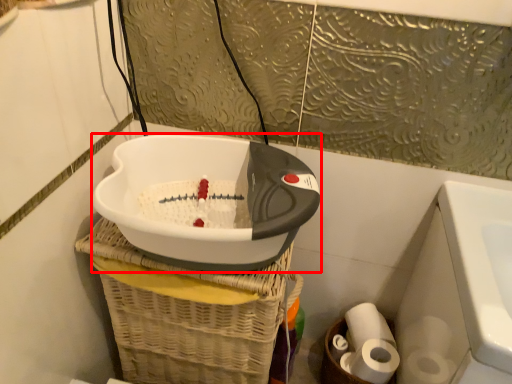
Question: From the image's perspective, what is the correct spatial relationship of appliance (annotated by the red box) in relation to toilet paper?

Choices:
 (A) below
 (B) above

Answer: (B)